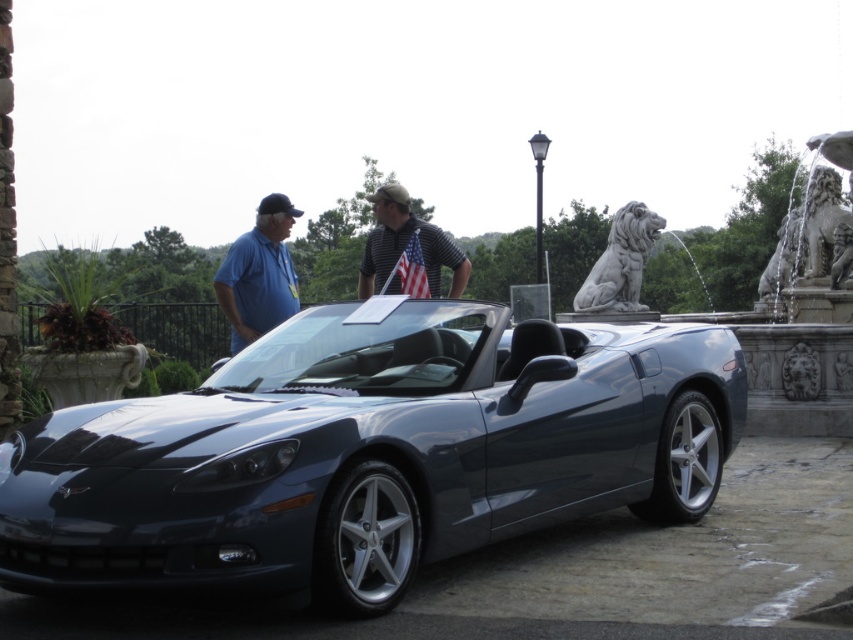
You are a photographer positioned to the front of the glossy metallic sports car at center and the white stone lion at right. Which object is closer to your left side?

The glossy metallic sports car at center is closer to your left side because it is positioned to the left of the white stone lion at right from your perspective.